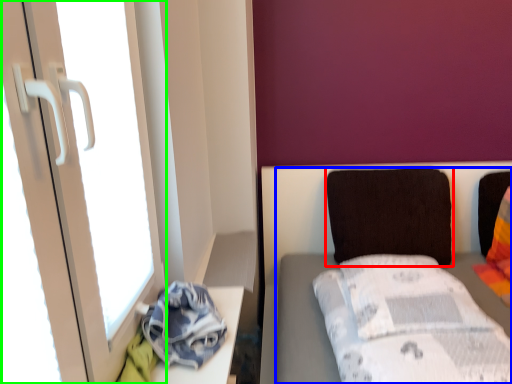
Question: Estimate the real-world distances between objects in this image. Which object is closer to pillow (highlighted by a red box), furniture (highlighted by a blue box) or screen door (highlighted by a green box)?

Choices:
 (A) furniture
 (B) screen door

Answer: (A)